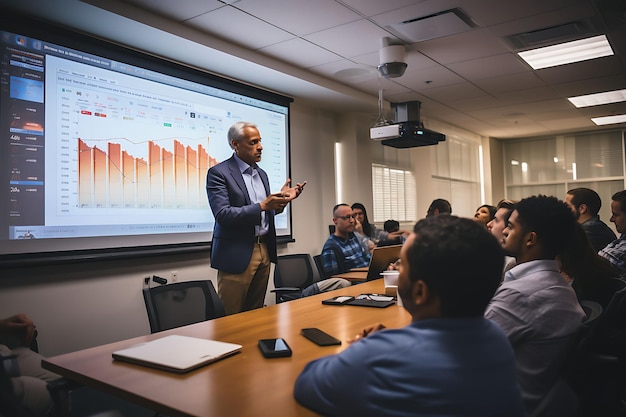
Locate an element on the screen. The height and width of the screenshot is (417, 626). chairs is located at coordinates (186, 297), (299, 276), (317, 265), (176, 322).